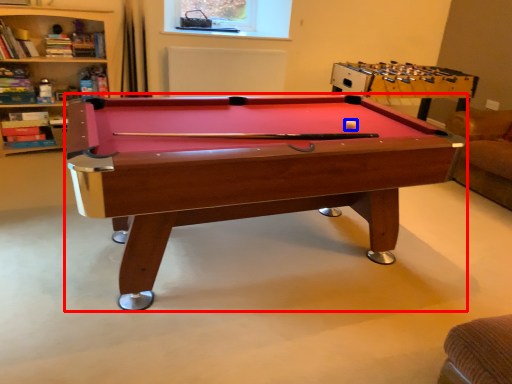
Question: Which object appears closest to the camera in this image, billiard table (highlighted by a red box) or ball (highlighted by a blue box)?

Choices:
 (A) billiard table
 (B) ball

Answer: (A)